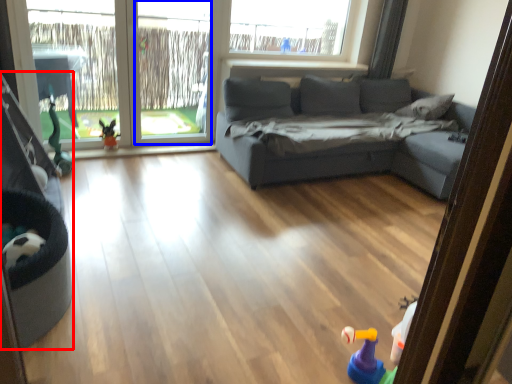
Question: Which point is closer to the camera, baby carriage (highlighted by a red box) or window screen (highlighted by a blue box)?

Choices:
 (A) baby carriage
 (B) window screen

Answer: (A)